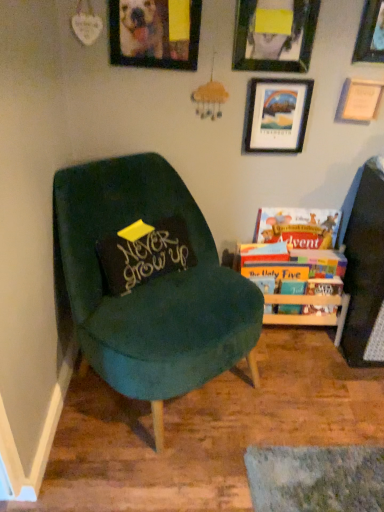
I want to click on vacant space in front of velvet green chair at left, so click(170, 466).